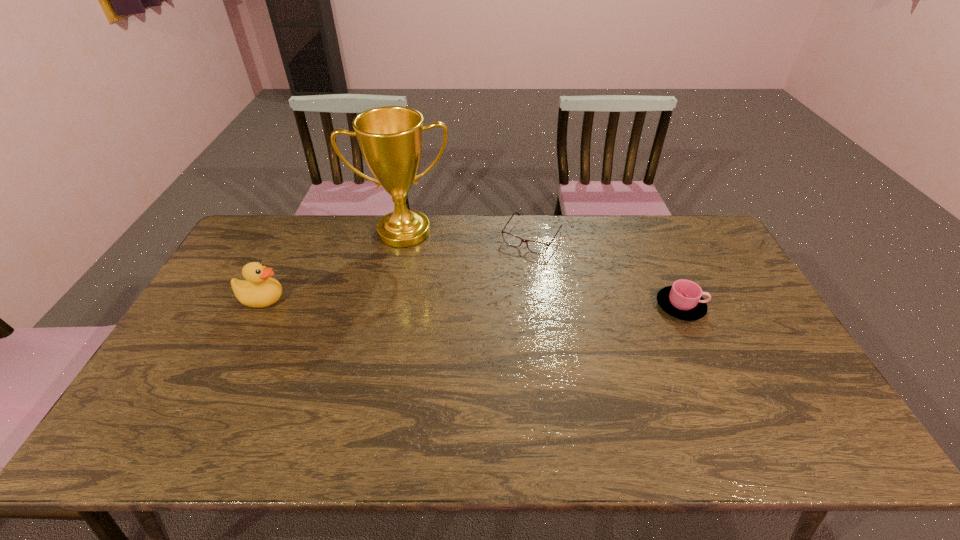
In order to click on the leftmost object in this screenshot , I will do `click(258, 290)`.

The image size is (960, 540). Identify the location of the second tallest object. (x=258, y=290).

You are a GUI agent. You are given a task and a screenshot of the screen. Output one action in this format:
    pyautogui.click(x=<x>, y=<y>)
    Task: Click on the rightmost object
    The image size is (960, 540).
    Given the screenshot: What is the action you would take?
    pyautogui.click(x=683, y=300)

This screenshot has width=960, height=540. I want to click on the second shortest object, so click(x=683, y=300).

Identify the location of the tallest object. This screenshot has width=960, height=540. (390, 138).

The image size is (960, 540). Identify the location of the second object from left to right. (390, 138).

Locate an element on the screen. the shortest object is located at coordinates (534, 246).

Image resolution: width=960 pixels, height=540 pixels. I want to click on the second object from right to left, so click(534, 246).

Image resolution: width=960 pixels, height=540 pixels. Identify the location of free space located at the beak of the leftmost object. (379, 299).

You are a GUI agent. You are given a task and a screenshot of the screen. Output one action in this format:
    pyautogui.click(x=<x>, y=<y>)
    Task: Click on the vacant area situated on the side with the handle of the cup
    
    Given the screenshot: What is the action you would take?
    pyautogui.click(x=754, y=306)